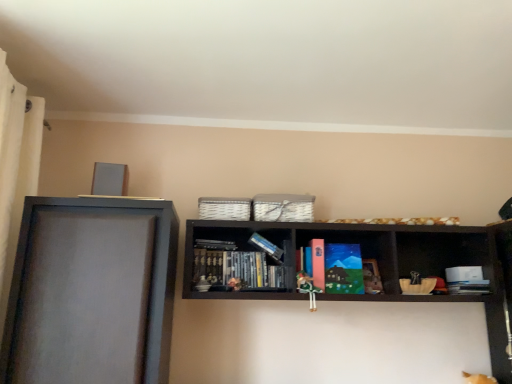
Where is `wooden bookshelf at center, the 1th shelf positioned from the right`? The height and width of the screenshot is (384, 512). wooden bookshelf at center, the 1th shelf positioned from the right is located at coordinates (362, 255).

This screenshot has width=512, height=384. What are the coordinates of `black matte bookshelf at center, the second book positioned from the right` in the screenshot? It's located at (215, 245).

The image size is (512, 384). Describe the element at coordinates (343, 269) in the screenshot. I see `matte paperback book at center` at that location.

Image resolution: width=512 pixels, height=384 pixels. Describe the element at coordinates (469, 287) in the screenshot. I see `hardcover book at center, which appears as the first book when ordered from the bottom` at that location.

Identify the location of matte gray frame at left, positioned as the 1th shelf in left-to-right order. (92, 292).

Is hardcover book at center, which appears as the first book when ordered from the bottom, located outside matte gray frame at left, the 2th shelf positioned from the right?

Absolutely, hardcover book at center, which appears as the first book when ordered from the bottom, is external to matte gray frame at left, the 2th shelf positioned from the right.

Is matte gray frame at left, the 2th shelf positioned from the right, at the back of hardcover book at center, arranged as the second book when viewed from the top?

No, matte gray frame at left, the 2th shelf positioned from the right, is not at the back of hardcover book at center, arranged as the second book when viewed from the top.

The width and height of the screenshot is (512, 384). In order to click on the 2nd shelf in front when counting from the hardcover book at center, marked as the 2th book in a left-to-right arrangement in this screenshot , I will do `click(92, 292)`.

From the image's perspective, is hardcover book at center, arranged as the second book when viewed from the top, located beneath matte gray frame at left, positioned as the 1th shelf in left-to-right order?

Correct, hardcover book at center, arranged as the second book when viewed from the top, appears lower than matte gray frame at left, positioned as the 1th shelf in left-to-right order, in the image.

Is matte gray frame at left, positioned as the 1th shelf in left-to-right order, positioned behind black matte bookshelf at center, the second book positioned from the right?

No, the depth of matte gray frame at left, positioned as the 1th shelf in left-to-right order, is less than that of black matte bookshelf at center, the second book positioned from the right.

Considering the relative sizes of matte gray frame at left, positioned as the 1th shelf in left-to-right order, and black matte bookshelf at center, the second book positioned from the right, in the image provided, is matte gray frame at left, positioned as the 1th shelf in left-to-right order, wider than black matte bookshelf at center, the second book positioned from the right,?

Indeed, matte gray frame at left, positioned as the 1th shelf in left-to-right order, has a greater width compared to black matte bookshelf at center, the second book positioned from the right.

Based on the photo, is matte gray frame at left, the 2th shelf positioned from the right, facing towards black matte bookshelf at center, which is the second book in bottom-to-top order?

No.

Is matte gray frame at left, the 2th shelf positioned from the right, taller or shorter than black matte bookshelf at center, which is the second book in bottom-to-top order?

matte gray frame at left, the 2th shelf positioned from the right, is taller than black matte bookshelf at center, which is the second book in bottom-to-top order.

Looking at this image, which of these two, matte gray frame at left, the 2th shelf positioned from the right, or green fabric doll at center, is wider?

With larger width is matte gray frame at left, the 2th shelf positioned from the right.

Does matte gray frame at left, the 2th shelf positioned from the right, appear on the right side of green fabric doll at center?

Incorrect, matte gray frame at left, the 2th shelf positioned from the right, is not on the right side of green fabric doll at center.

Does matte gray frame at left, positioned as the 1th shelf in left-to-right order, have a lesser height compared to green fabric doll at center?

Incorrect, the height of matte gray frame at left, positioned as the 1th shelf in left-to-right order, does not fall short of that of green fabric doll at center.

In the scene shown: Is wooden bookshelf at center, the 1th shelf positioned from the right, wider or thinner than matte gray frame at left, the 2th shelf positioned from the right?

In the image, wooden bookshelf at center, the 1th shelf positioned from the right, appears to be more narrow than matte gray frame at left, the 2th shelf positioned from the right.

The image size is (512, 384). In order to click on shelf that appears below the wooden bookshelf at center, the 1th shelf positioned from the right (from the image's perspective) in this screenshot , I will do `click(92, 292)`.

Which is behind, point (192, 251) or point (106, 228)?

Positioned behind is point (192, 251).

Is wooden bookshelf at center, the 1th shelf positioned from the right, located outside matte gray frame at left, the 2th shelf positioned from the right?

Indeed, wooden bookshelf at center, the 1th shelf positioned from the right, is completely outside matte gray frame at left, the 2th shelf positioned from the right.

Is matte paperback book at center not close to black matte bookshelf at center, placed as the 1th book when sorted from left to right?

No, there isn't a large distance between matte paperback book at center and black matte bookshelf at center, placed as the 1th book when sorted from left to right.

From a real-world perspective, is matte paperback book at center positioned under black matte bookshelf at center, placed as the 1th book when sorted from left to right, based on gravity?

Indeed, from a real-world perspective, matte paperback book at center is positioned beneath black matte bookshelf at center, placed as the 1th book when sorted from left to right.

Based on their sizes in the image, would you say matte paperback book at center is bigger or smaller than black matte bookshelf at center, the second book positioned from the right?

matte paperback book at center is bigger than black matte bookshelf at center, the second book positioned from the right.

From a real-world perspective, between matte paperback book at center and wooden bookshelf at center, which is the second shelf from left to right, who is vertically higher?

From a 3D spatial view, wooden bookshelf at center, which is the second shelf from left to right, is above.

Is matte paperback book at center not inside wooden bookshelf at center, which is the second shelf from left to right?

No, most part of matte paperback book at center lies within wooden bookshelf at center, which is the second shelf from left to right.

Which object is closer to the camera, matte paperback book at center or wooden bookshelf at center, the 1th shelf positioned from the right?

wooden bookshelf at center, the 1th shelf positioned from the right.

Between matte paperback book at center and wooden bookshelf at center, which is the second shelf from left to right, which one has smaller width?

Thinner between the two is matte paperback book at center.

Which object is wider, hardcover book at center, the first book from the right, or matte paperback book at center?

hardcover book at center, the first book from the right.

Can you confirm if hardcover book at center, marked as the 2th book in a left-to-right arrangement, is shorter than matte paperback book at center?

Yes, hardcover book at center, marked as the 2th book in a left-to-right arrangement, is shorter than matte paperback book at center.

Considering the relative sizes of hardcover book at center, arranged as the second book when viewed from the top, and matte paperback book at center in the image provided, is hardcover book at center, arranged as the second book when viewed from the top, smaller than matte paperback book at center?

Indeed, hardcover book at center, arranged as the second book when viewed from the top, has a smaller size compared to matte paperback book at center.

Identify the location of shelf that appears below the hardcover book at center, the first book from the right (from a real-world perspective). This screenshot has height=384, width=512. (92, 292).

From a real-world perspective, which book is the 2nd one above the matte gray frame at left, positioned as the 1th shelf in left-to-right order? Please provide its 2D coordinates.

[(215, 245)]

Looking at the image, which one is located closer to black matte bookshelf at center, the second book positioned from the right, matte gray frame at left, the 2th shelf positioned from the right, or matte paperback book at center?

Based on the image, matte paperback book at center appears to be nearer to black matte bookshelf at center, the second book positioned from the right.

From the image, which object appears to be nearer to green fabric doll at center, matte paperback book at center or matte gray frame at left, positioned as the 1th shelf in left-to-right order?

The object closer to green fabric doll at center is matte paperback book at center.

From the image, which object appears to be nearer to green fabric doll at center, hardcover book at center, arranged as the second book when viewed from the top, or matte gray frame at left, positioned as the 1th shelf in left-to-right order?

Based on the image, hardcover book at center, arranged as the second book when viewed from the top, appears to be nearer to green fabric doll at center.

Looking at the image, which one is located further to wooden bookshelf at center, which is the second shelf from left to right, matte gray frame at left, the 2th shelf positioned from the right, or green fabric doll at center?

matte gray frame at left, the 2th shelf positioned from the right.

Which object lies further to the anchor point matte paperback book at center, black matte bookshelf at center, which is the second book in bottom-to-top order, or hardcover book at center, marked as the 2th book in a left-to-right arrangement?

Among the two, black matte bookshelf at center, which is the second book in bottom-to-top order, is located further to matte paperback book at center.

Estimate the real-world distances between objects in this image. Which object is further from matte gray frame at left, positioned as the 1th shelf in left-to-right order, wooden bookshelf at center, the 1th shelf positioned from the right, or matte paperback book at center?

Among the two, matte paperback book at center is located further to matte gray frame at left, positioned as the 1th shelf in left-to-right order.

Estimate the real-world distances between objects in this image. Which object is closer to black matte bookshelf at center, placed as the 1th book when sorted from left to right, matte gray frame at left, positioned as the 1th shelf in left-to-right order, or hardcover book at center, which appears as the first book when ordered from the bottom?

matte gray frame at left, positioned as the 1th shelf in left-to-right order, is positioned closer to the anchor black matte bookshelf at center, placed as the 1th book when sorted from left to right.

From the picture: Which object lies further to the anchor point hardcover book at center, arranged as the second book when viewed from the top, black matte bookshelf at center, which is the second book in bottom-to-top order, or wooden bookshelf at center, which is the second shelf from left to right?

black matte bookshelf at center, which is the second book in bottom-to-top order, lies further to hardcover book at center, arranged as the second book when viewed from the top, than the other object.

Where is `shelf between matte gray frame at left, the 2th shelf positioned from the right, and hardcover book at center, which appears as the first book when ordered from the bottom, from left to right`? This screenshot has width=512, height=384. shelf between matte gray frame at left, the 2th shelf positioned from the right, and hardcover book at center, which appears as the first book when ordered from the bottom, from left to right is located at coordinates (362, 255).

You are a GUI agent. You are given a task and a screenshot of the screen. Output one action in this format:
    pyautogui.click(x=<x>, y=<y>)
    Task: Click on the paperback book between wooden bookshelf at center, which is the second shelf from left to right, and hardcover book at center, which appears as the first book when ordered from the bottom, in the horizontal direction
    The height and width of the screenshot is (384, 512).
    Given the screenshot: What is the action you would take?
    pyautogui.click(x=343, y=269)

This screenshot has width=512, height=384. Identify the location of toy located between matte gray frame at left, the 2th shelf positioned from the right, and matte paperback book at center in the left-right direction. (308, 289).

Identify the location of shelf situated between black matte bookshelf at center, the second book positioned from the right, and matte paperback book at center from left to right. The height and width of the screenshot is (384, 512). (362, 255).